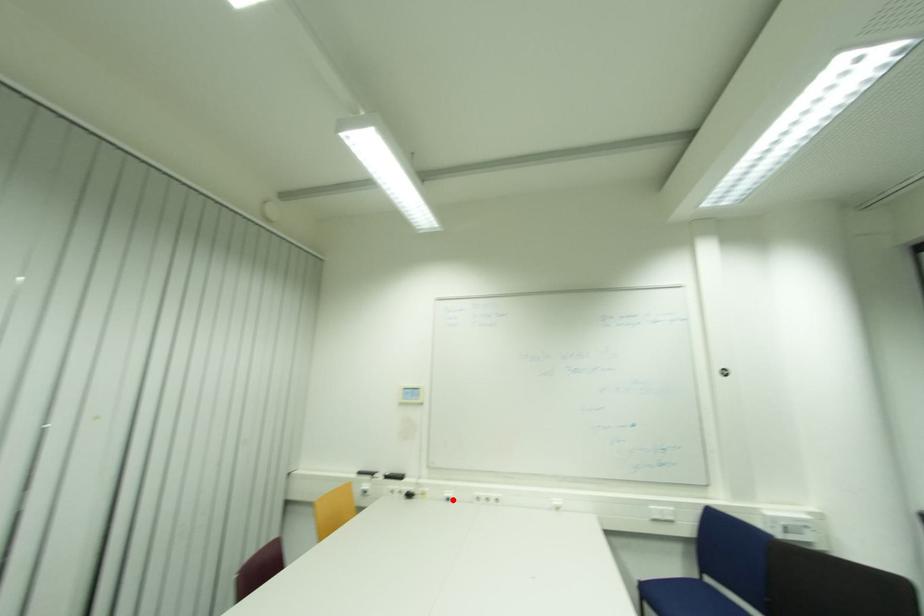
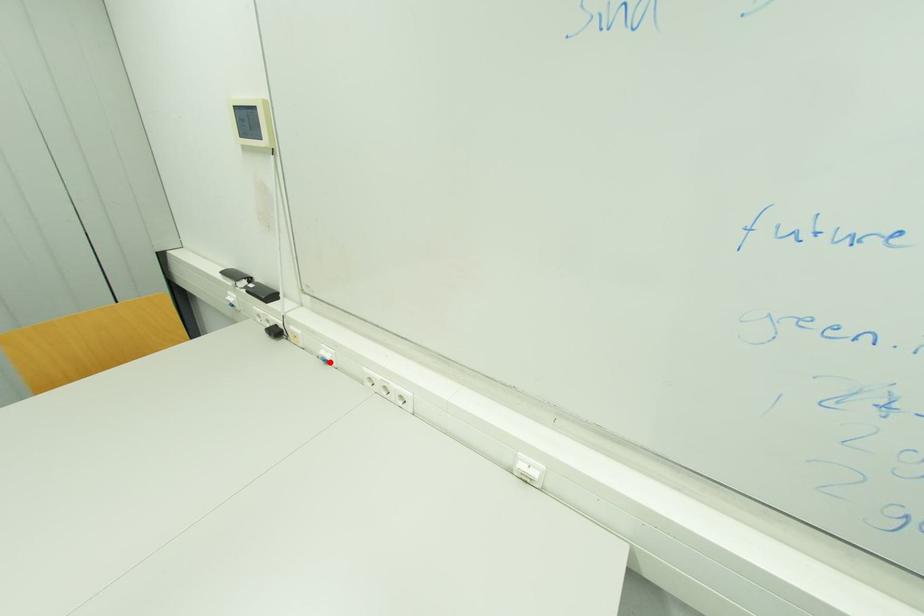
I am providing you with two images of the same scene from different viewpoints. A red point is marked on the first image and another point is marked on the second image. Does the point marked in image1 correspond to the same location as the one in image2?

Yes